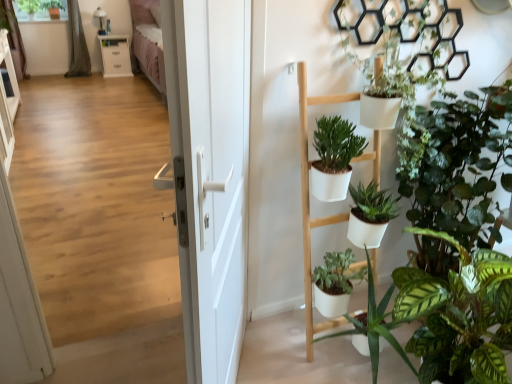
Question: Considering the positions of gray fabric curtain at upper left, the 2th curtain from the left, and green matte plant at upper left, arranged as the first plant when viewed from the left, in the image, is gray fabric curtain at upper left, the 2th curtain from the left, taller or shorter than green matte plant at upper left, arranged as the first plant when viewed from the left,?

Choices:
 (A) short
 (B) tall

Answer: (B)

Question: Considering the relative positions of gray fabric curtain at upper left, the 2th curtain from the left, and green matte plant at upper left, the 2th plant in the right-to-left sequence, in the image provided, is gray fabric curtain at upper left, the 2th curtain from the left, to the left or to the right of green matte plant at upper left, the 2th plant in the right-to-left sequence,?

Choices:
 (A) right
 (B) left

Answer: (A)

Question: Which object is positioned farthest from the gray fabric curtain at upper left, the 2th curtain from the left?

Choices:
 (A) wooden floor at center
 (B) white matte door at center
 (C) green matte plant at upper left, arranged as the first plant when viewed from the left
 (D) green fabric curtain at upper left, the 1th curtain viewed from the left
 (E) white glossy cabinet at upper left

Answer: (B)

Question: Which object is the closest to the green fabric curtain at upper left, placed as the second curtain when sorted from right to left?

Choices:
 (A) green matte plant at upper left, marked as the 2th plant in a left-to-right arrangement
 (B) white matte door at center
 (C) gray fabric curtain at upper left, which is the 1th curtain in right-to-left order
 (D) green matte plant at upper left, arranged as the first plant when viewed from the left
 (E) wooden floor at center

Answer: (D)